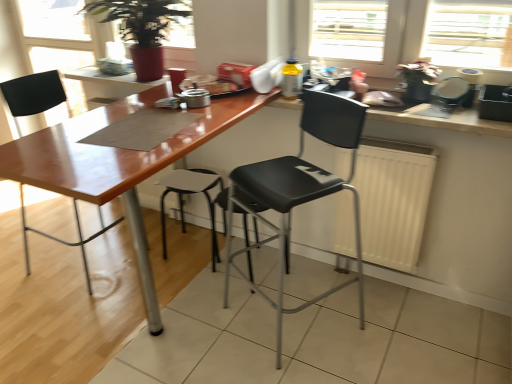
I want to click on vacant area that is in front of matte black stool at center, so click(192, 288).